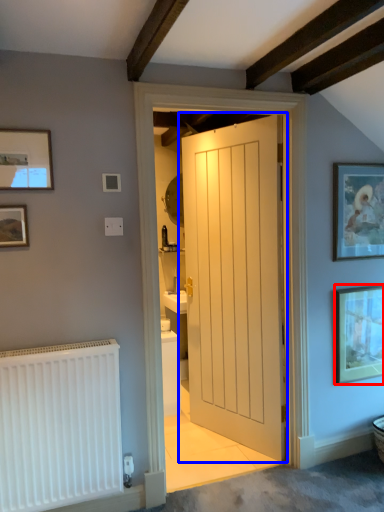
Question: Which object appears farthest to the camera in this image, picture frame (highlighted by a red box) or door (highlighted by a blue box)?

Choices:
 (A) picture frame
 (B) door

Answer: (A)